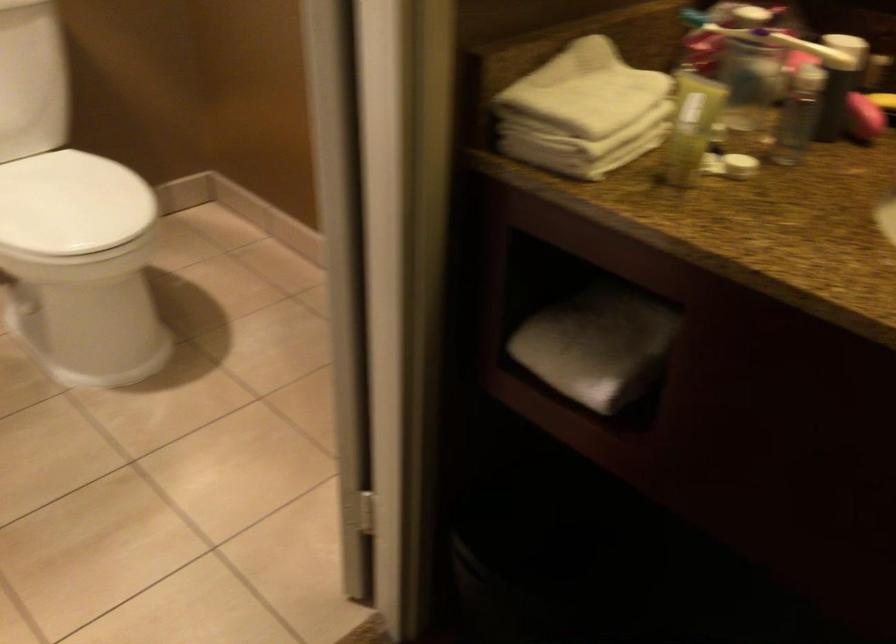
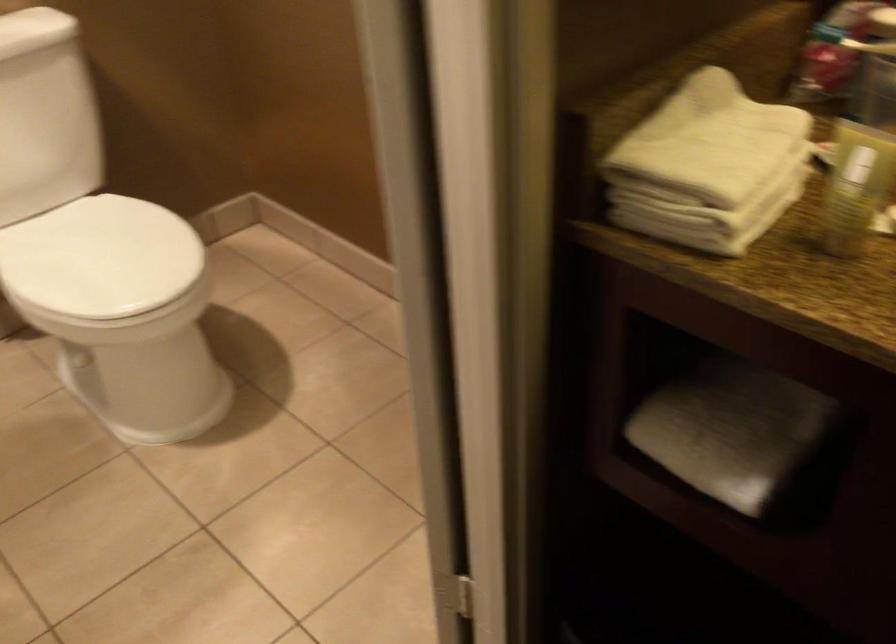
Find the pixel in the second image that matches (x=587, y=90) in the first image.

(711, 140)